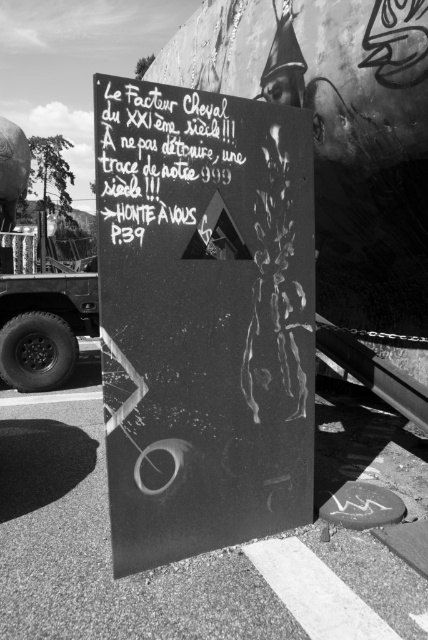
Is black matte sign at center taller than black chalkboard sign at upper center?

Correct, black matte sign at center is much taller as black chalkboard sign at upper center.

Measure the distance from black matte sign at center to black chalkboard sign at upper center.

A distance of 9.60 inches exists between black matte sign at center and black chalkboard sign at upper center.

Who is more forward, (112, 208) or (157, 128)?

Point (112, 208) is more forward.

Find the location of `black matte sign at center`. black matte sign at center is located at coordinates (204, 317).

Is point (169, 474) less distant than point (62, 288)?

Yes, point (169, 474) is in front of point (62, 288).

Does point (175, 547) come closer to viewer compared to point (27, 225)?

Yes, point (175, 547) is in front of point (27, 225).

Image resolution: width=428 pixels, height=640 pixels. Identify the location of black matte sign at center. (204, 317).

Does black chalkboard sign at upper center appear on the left side of metallic truck tire at left?

No, black chalkboard sign at upper center is not to the left of metallic truck tire at left.

Is the position of black chalkboard sign at upper center more distant than that of metallic truck tire at left?

No.

Who is more distant from viewer, (x=121, y=237) or (x=73, y=214)?

The point (x=73, y=214) is behind.

Where is `black chalkboard sign at upper center`? The height and width of the screenshot is (640, 428). black chalkboard sign at upper center is located at coordinates (165, 166).